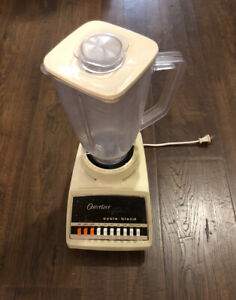
The image size is (236, 300). What are the coordinates of `blender lid` in the screenshot? It's located at (113, 86).